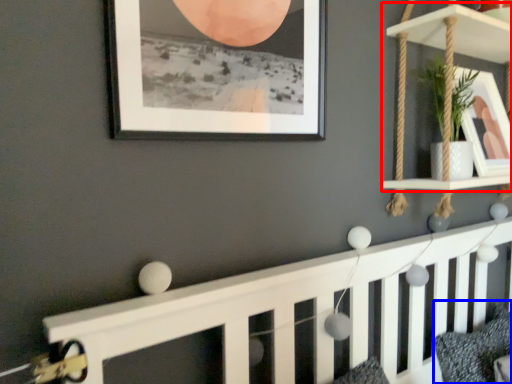
Question: Which object is further to the camera taking this photo, shelf (highlighted by a red box) or pillow (highlighted by a blue box)?

Choices:
 (A) shelf
 (B) pillow

Answer: (B)